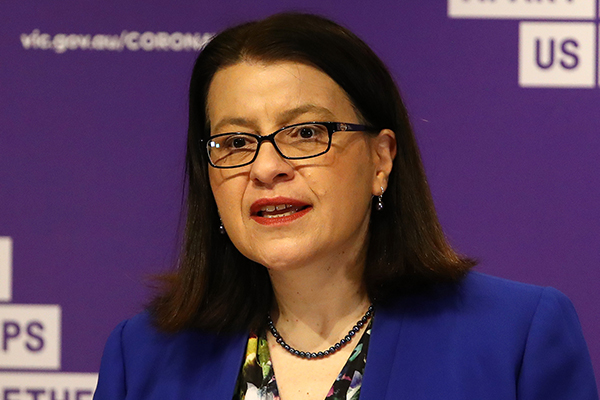
Locate an element on the screen. The height and width of the screenshot is (400, 600). purple wall is located at coordinates (98, 264).